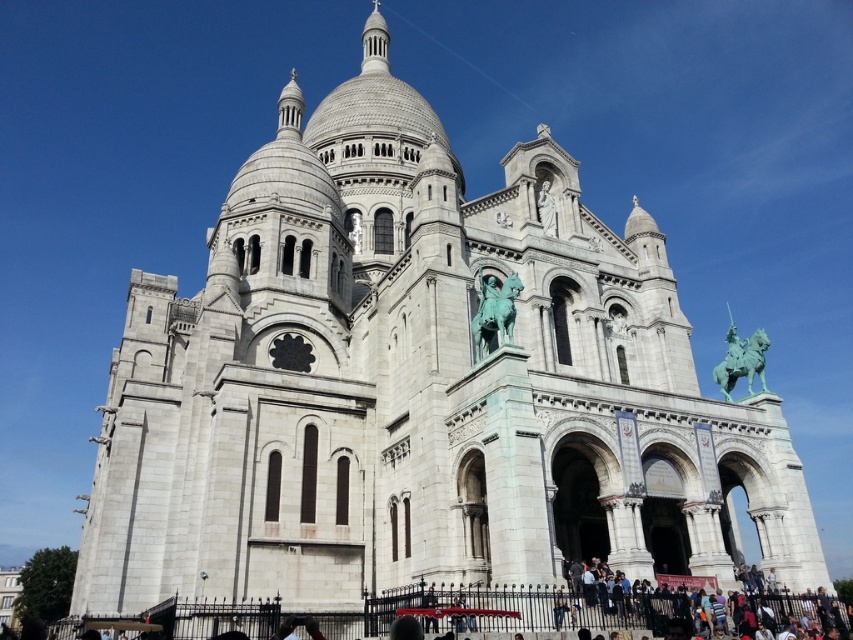
Question: Which object appears farthest from the camera in this image?

Choices:
 (A) white stone statue at upper center
 (B) green patina bronze statue at center
 (C) green patina statue at center

Answer: (C)

Question: Can you confirm if green patina horseman at upper right is positioned to the left of green patina statue at center?

Choices:
 (A) yes
 (B) no

Answer: (B)

Question: Which point appears farthest from the camera in this image?

Choices:
 (A) (360, 234)
 (B) (540, 192)
 (C) (727, 342)
 (D) (511, 321)

Answer: (C)

Question: Does green patina bronze statue at center appear under white stone statue at upper center?

Choices:
 (A) no
 (B) yes

Answer: (B)

Question: Is green patina horseman at upper right positioned in front of green patina statue at center?

Choices:
 (A) yes
 (B) no

Answer: (A)

Question: Among these objects, which one is farthest from the camera?

Choices:
 (A) green patina bronze statue at center
 (B) green patina statue at center
 (C) white stone statue at upper center

Answer: (B)